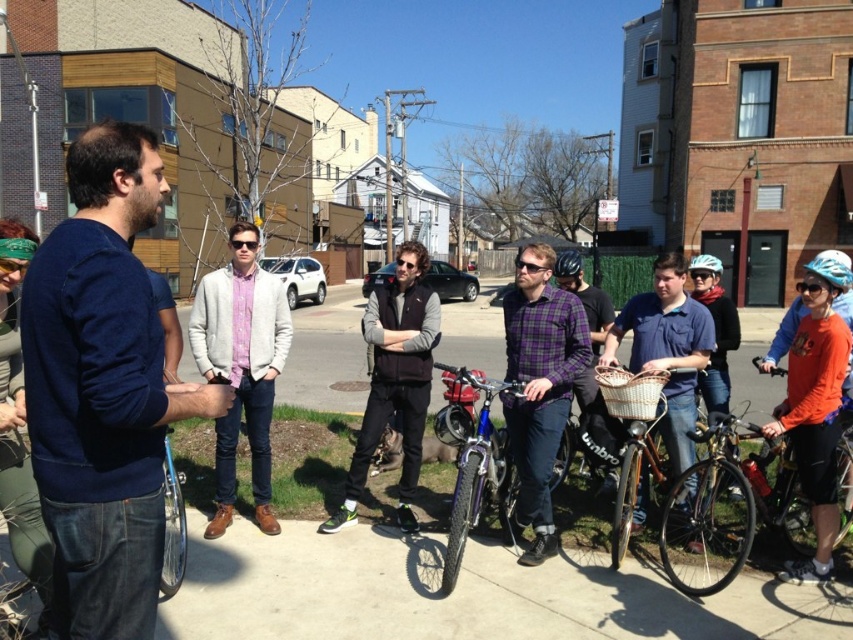
You are a photographer trying to capture a group photo of the dark blue sweater at left and the matte purple shirt at center. Since you want to ensure both subjects are in focus, you need to know their heights. Which subject is taller?

The dark blue sweater at left is taller than the matte purple shirt at center.

You are standing at the origin point of the image and want to locate the dark blue sweater at left. In which direction should you look to find it?

The dark blue sweater at left is located at point 0.611 on the x axis and 0.121 on the y axis. Since the x coordinate is greater than 0.5, you should look to the right side of the image to find it.